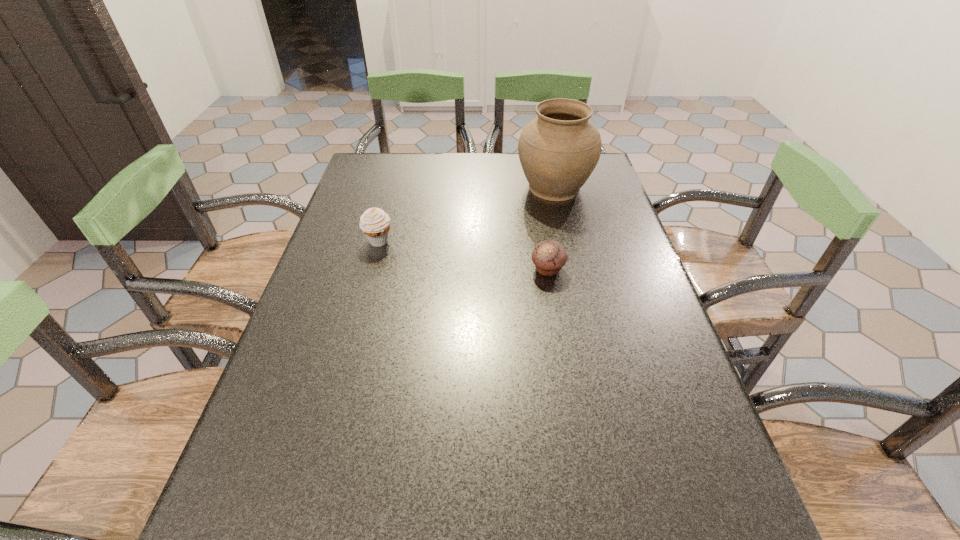
You are a GUI agent. You are given a task and a screenshot of the screen. Output one action in this format:
    pyautogui.click(x=<x>, y=<y>)
    Task: Click on the object located in the left edge section of the desktop
    
    Given the screenshot: What is the action you would take?
    pyautogui.click(x=375, y=223)

At what (x,y) coordinates should I click in order to perform the action: click on object that is at the right edge. Please return your answer as a coordinate pair (x, y). Looking at the image, I should click on (558, 151).

Locate an element on the screen. The image size is (960, 540). object that is at the far right corner is located at coordinates (558, 151).

Where is `free spot at the far edge of the desktop`? free spot at the far edge of the desktop is located at coordinates (516, 155).

Find the location of a particular element. The image size is (960, 540). vacant space at the left edge is located at coordinates tap(326, 292).

This screenshot has height=540, width=960. In the image, there is a desktop. What are the coordinates of `vacant area at the right edge` in the screenshot? It's located at tap(619, 216).

Find the location of `vacant space that's between the nearest object and the urn`. vacant space that's between the nearest object and the urn is located at coordinates (551, 228).

Where is `empty space between the taller muffin and the tallest object`? This screenshot has width=960, height=540. empty space between the taller muffin and the tallest object is located at coordinates (467, 214).

This screenshot has height=540, width=960. Identify the location of free space between the second tallest object and the tallest object. (467, 214).

Locate an element on the screen. This screenshot has height=540, width=960. empty space between the urn and the left muffin is located at coordinates (467, 214).